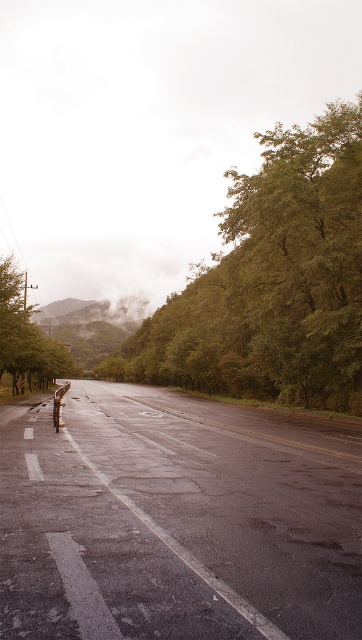
Question: Which point is closer to the camera?

Choices:
 (A) green leafy tree at center
 (B) green leafy tree at left

Answer: (A)

Question: Does green leafy tree at center appear on the right side of green leafy tree at left?

Choices:
 (A) yes
 (B) no

Answer: (A)

Question: Which point is closer to the camera?

Choices:
 (A) green leafy tree at left
 (B) green leafy tree at center

Answer: (B)

Question: Is green leafy tree at center below green leafy tree at left?

Choices:
 (A) yes
 (B) no

Answer: (B)

Question: Does green leafy tree at center have a larger size compared to green leafy tree at left?

Choices:
 (A) no
 (B) yes

Answer: (B)